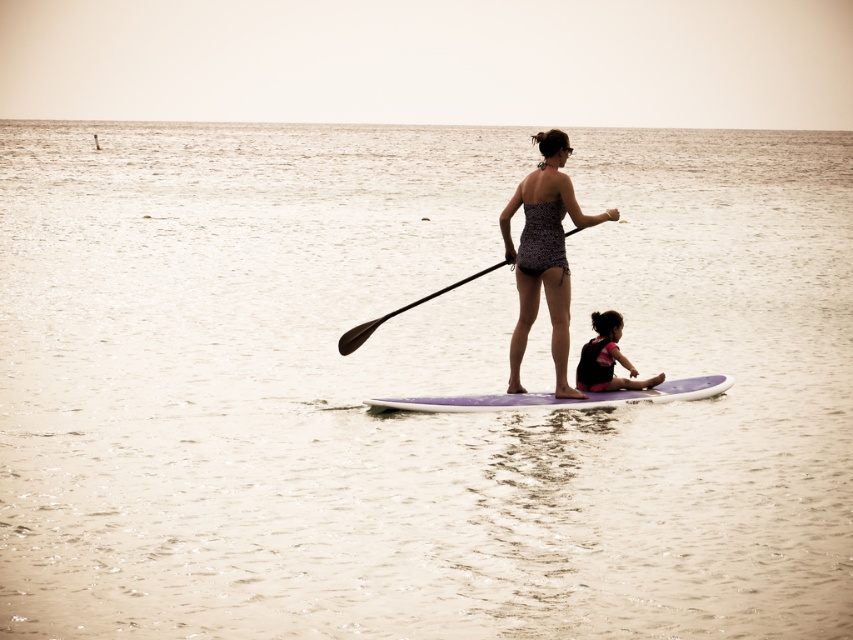
Question: Which of the following is the closest to the observer?

Choices:
 (A) printed fabric swimsuit at center
 (B) black rubber paddle at center
 (C) matte pink swimsuit at center

Answer: (A)

Question: Does printed fabric swimsuit at center come in front of black rubber paddle at center?

Choices:
 (A) no
 (B) yes

Answer: (B)

Question: Among these points, which one is farthest from the camera?

Choices:
 (A) (607, 355)
 (B) (543, 392)

Answer: (B)

Question: Does printed fabric swimsuit at center have a lesser width compared to matte pink swimsuit at center?

Choices:
 (A) yes
 (B) no

Answer: (B)

Question: Does printed fabric swimsuit at center appear under black rubber paddle at center?

Choices:
 (A) no
 (B) yes

Answer: (A)

Question: Which point is closer to the camera?

Choices:
 (A) (390, 403)
 (B) (550, 244)

Answer: (B)